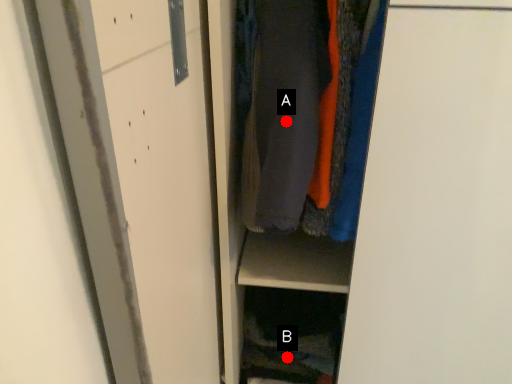
Question: Two points are circled on the image, labeled by A and B beside each circle. Which point is closer to the camera?

Choices:
 (A) A is closer
 (B) B is closer

Answer: (A)